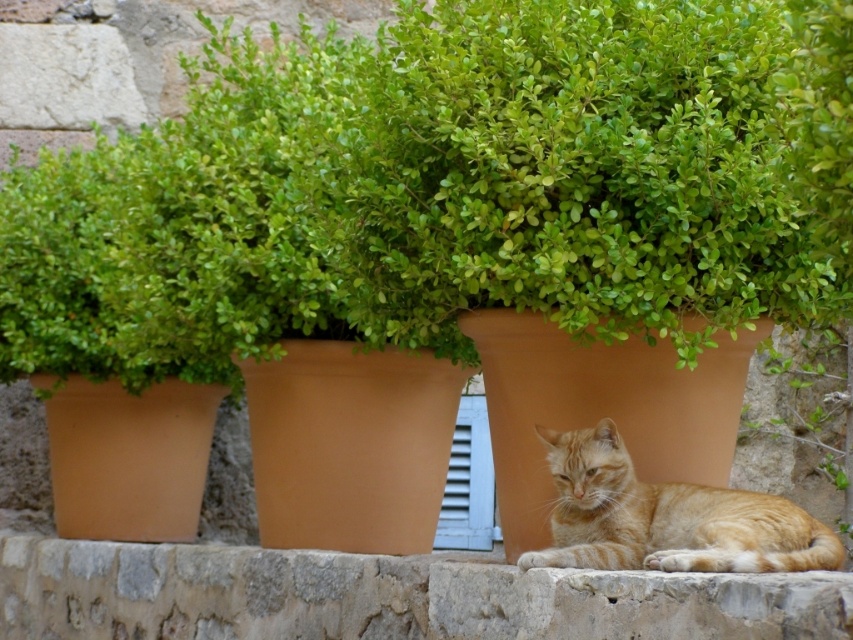
Question: Can you confirm if orange tabby cat at lower center is positioned to the left of white plastic window at center?

Choices:
 (A) yes
 (B) no

Answer: (B)

Question: Does orange tabby cat at lower center come in front of white plastic window at center?

Choices:
 (A) yes
 (B) no

Answer: (A)

Question: Among these points, which one is farthest from the camera?

Choices:
 (A) (466, 493)
 (B) (590, 454)

Answer: (A)

Question: Which point is closer to the camera?

Choices:
 (A) white plastic window at center
 (B) orange tabby cat at lower center

Answer: (B)

Question: Can you confirm if orange tabby cat at lower center is positioned to the left of white plastic window at center?

Choices:
 (A) yes
 (B) no

Answer: (B)